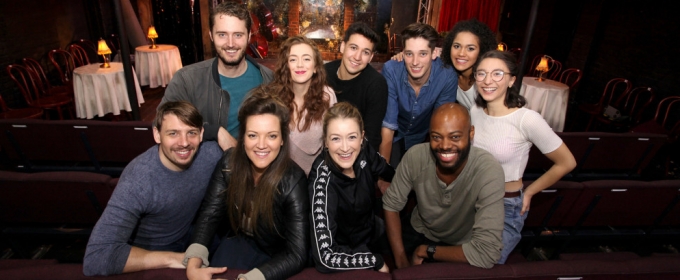
Find the location of a particular element. The height and width of the screenshot is (280, 680). leftmost lamp is located at coordinates (103, 48).